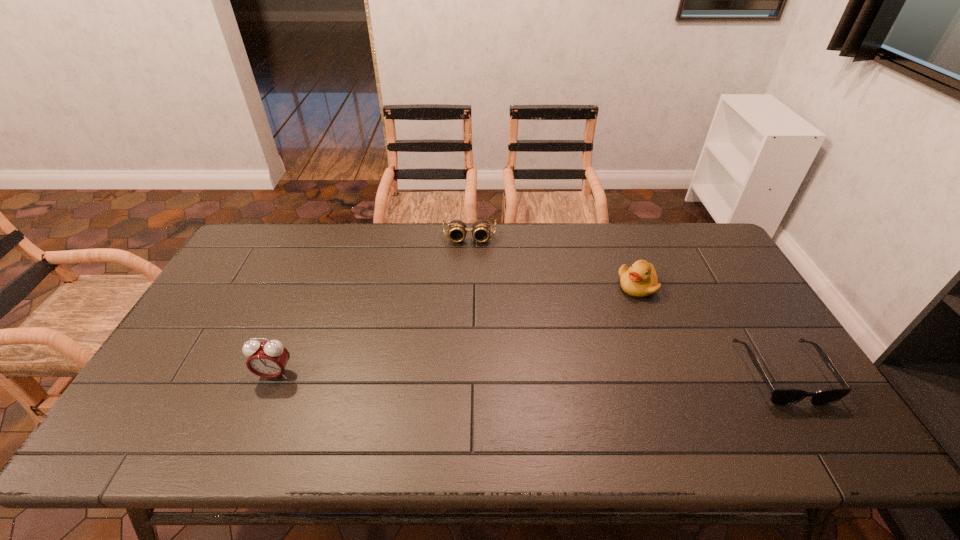
Locate an element on the screen. This screenshot has height=540, width=960. vacant space on the desktop that is between the alarm clock and the shortest object and is positioned through the lenses of the second object from left to right is located at coordinates (464, 374).

Identify the location of vacant space on the desktop that is between the alarm clock and the shortest object and is positioned at the beak of the second farthest object. This screenshot has width=960, height=540. (521, 374).